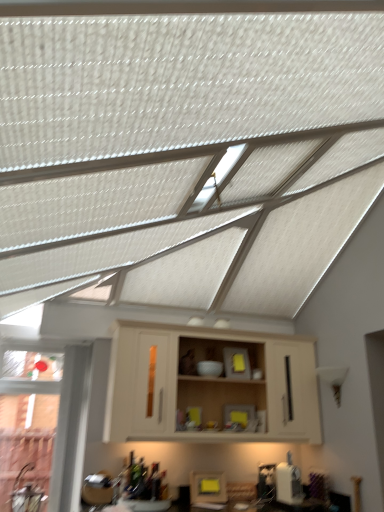
Question: Based on their sizes in the image, would you say yellow matte frame at lower center is bigger or smaller than beige wood cabinet at center?

Choices:
 (A) small
 (B) big

Answer: (A)

Question: From the image's perspective, is yellow matte frame at lower center positioned above or below beige wood cabinet at center?

Choices:
 (A) below
 (B) above

Answer: (A)

Question: Is point (213, 479) closer or farther from the camera than point (284, 411)?

Choices:
 (A) farther
 (B) closer

Answer: (B)

Question: Considering the positions of point (167, 437) and point (208, 480), is point (167, 437) closer or farther from the camera than point (208, 480)?

Choices:
 (A) farther
 (B) closer

Answer: (B)

Question: Is beige wood cabinet at center situated inside yellow matte frame at lower center or outside?

Choices:
 (A) inside
 (B) outside

Answer: (B)

Question: In terms of size, does beige wood cabinet at center appear bigger or smaller than yellow matte frame at lower center?

Choices:
 (A) small
 (B) big

Answer: (B)

Question: From a real-world perspective, is beige wood cabinet at center positioned above or below yellow matte frame at lower center?

Choices:
 (A) above
 (B) below

Answer: (A)